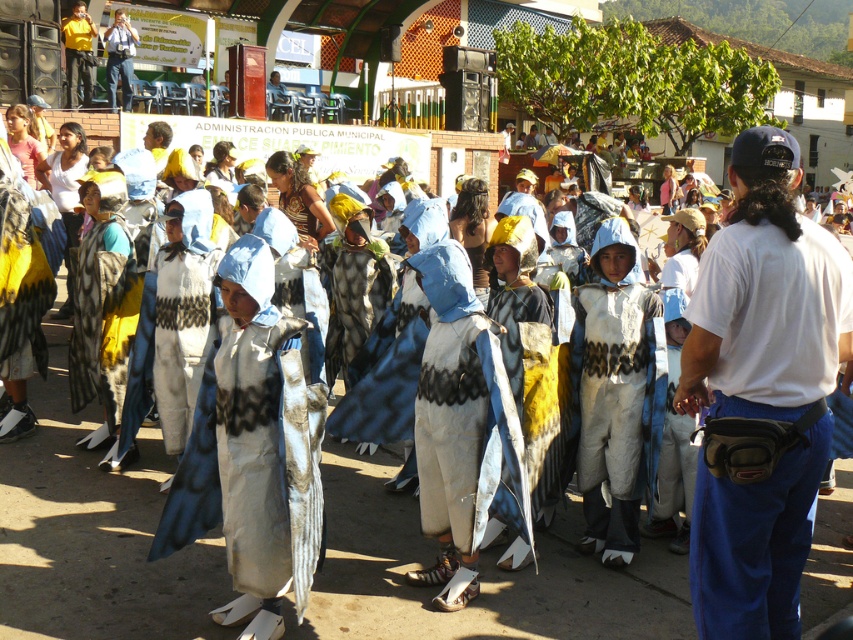
Consider the image. You are a photographer standing at the center of the town square, and you want to take a photo of both point (276, 467) and point (82, 10). Which point is closer to your camera?

Point (276, 467) is closer to the camera than point (82, 10).

You are a photographer at the event and want to take a photo that includes both the white fabric fanny pack at right and the yellow shirt at upper left. Which object will appear larger in the photo?

The white fabric fanny pack at right will appear larger in the photo because it is closer to the viewer than the yellow shirt at upper left.

You are a photographer at the event and want to capture the white fabric costume at center in your shot. If your camera has a zoom lens that can focus on objects within a 0.3 radius around a point, which point should you aim for to ensure the costume is in focus?

You should aim for the point at coordinates (x=254, y=451) to ensure the white fabric costume at center is in focus since the costume is located exactly at that point.